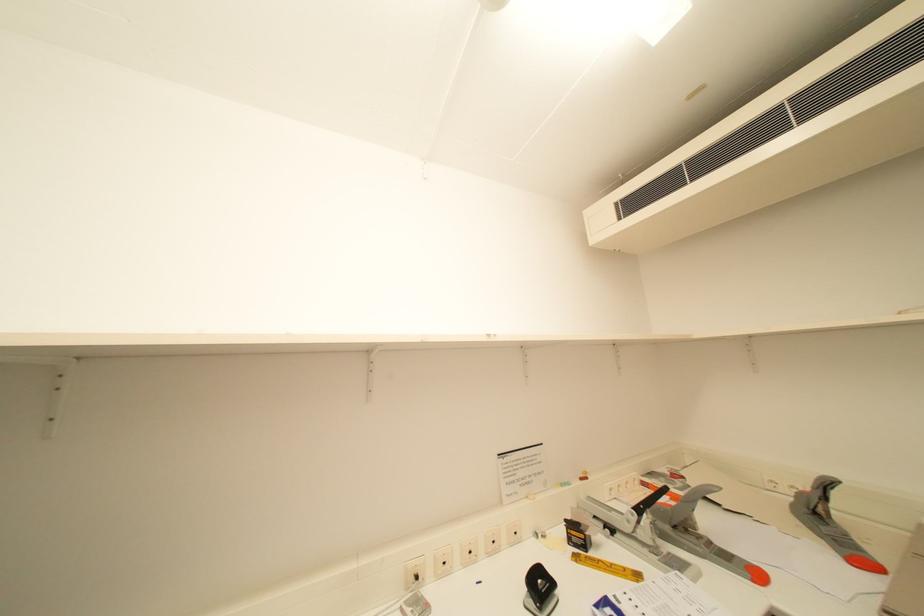
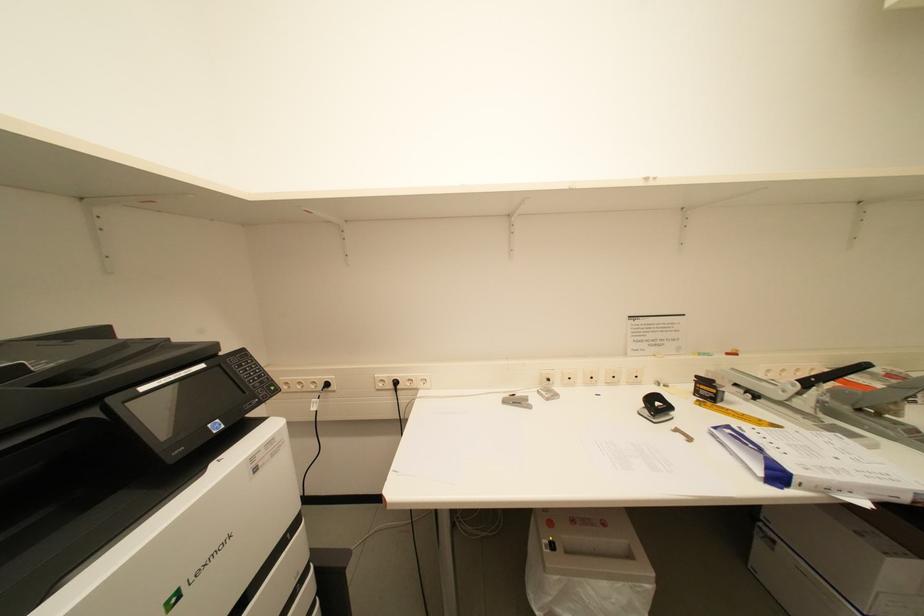
First-person continuous shooting, in which direction is the camera rotating?

The rotation direction of the camera is left-down.